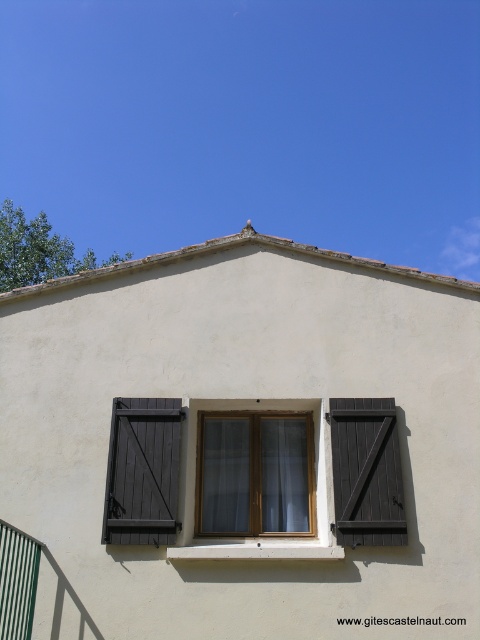
In the scene shown: You are standing in front of the building and want to reach the point marked at coordinates [395,480] on the wall. If your maximum reach is 5 meters, will you be able to touch this point without any tools?

The point at [395,480] is 5.52 meters away from the camera, which is beyond your maximum reach of 5 meters. Therefore, you cannot touch it without tools.

You are standing in front of the building and notice two points marked on the wall. The first point is at coordinates point (170, 493) and the second is at point (396, 492). Which point is closer to the bottom edge of the window?

Point (170, 493) is closer to the bottom edge of the window because it is positioned lower on the wall compared to point (396, 492).

In the scene shown: You are an architect designing a new building. You need to ensure that the matte wood window at center and the green striped rail at lower left are proportionate. Based on the scene, which object is wider?

The matte wood window at center is wider than the green striped rail at lower left, so the window should be designed to maintain its greater width for proportionality.